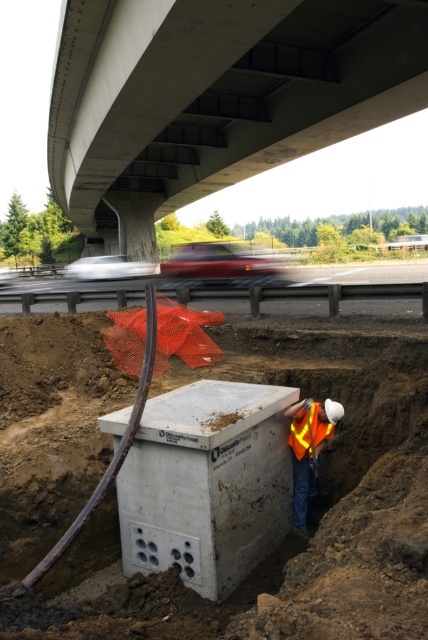
You are a safety inspector reviewing this construction site. You need to locate the reflective orange vest at center. What are the coordinates where it can be found?

The reflective orange vest at center is located at coordinates point (309, 452).

You are a construction supervisor observing the scene. There is a concrete at upper center and a concrete barrier at lower center. Which object is located above the other?

The concrete at upper center is positioned over the concrete barrier at lower center.